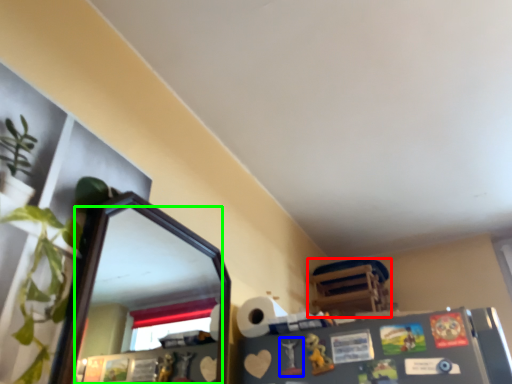
Question: Based on their relative distances, which object is farther from furniture (highlighted by a red box)? Choose from toy (highlighted by a blue box) and mirror (highlighted by a green box).

Choices:
 (A) toy
 (B) mirror

Answer: (B)